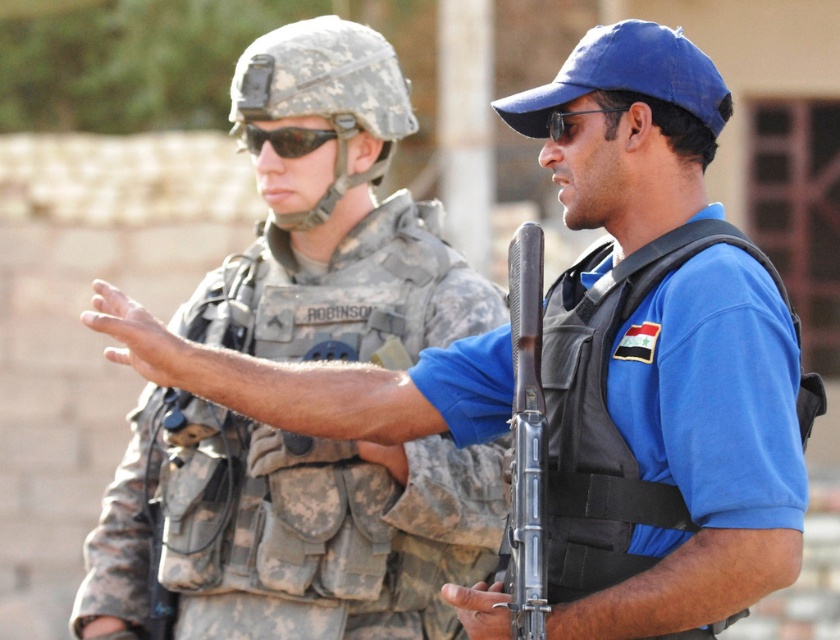
Does camouflage fabric uniform at center have a larger size compared to silver metallic rifle at center?

Incorrect, camouflage fabric uniform at center is not larger than silver metallic rifle at center.

Between camouflage fabric uniform at center and silver metallic rifle at center, which one is positioned lower?

camouflage fabric uniform at center is below.

Describe the element at coordinates (287, 529) in the screenshot. This screenshot has height=640, width=840. I see `camouflage fabric uniform at center` at that location.

Find the location of a particular element. Image resolution: width=840 pixels, height=640 pixels. camouflage fabric uniform at center is located at coordinates (287, 529).

Which of these two, silver metallic rifle at center or black matte sunglasses at center, stands taller?

With more height is silver metallic rifle at center.

Which is above, silver metallic rifle at center or black matte sunglasses at center?

Positioned higher is black matte sunglasses at center.

The height and width of the screenshot is (640, 840). What do you see at coordinates (526, 440) in the screenshot? I see `silver metallic rifle at center` at bounding box center [526, 440].

The height and width of the screenshot is (640, 840). In order to click on silver metallic rifle at center in this screenshot , I will do `click(526, 440)`.

Can you confirm if camouflage fabric uniform at center is shorter than black matte sunglasses at center?

Yes, camouflage fabric uniform at center is shorter than black matte sunglasses at center.

Can you confirm if camouflage fabric uniform at center is positioned to the right of black matte sunglasses at center?

Yes, camouflage fabric uniform at center is to the right of black matte sunglasses at center.

Who is more forward, (457, 307) or (303, 134)?

Point (457, 307) is in front.

At what (x,y) coordinates should I click in order to perform the action: click on camouflage fabric uniform at center. Please return your answer as a coordinate pair (x, y). The width and height of the screenshot is (840, 640). Looking at the image, I should click on (287, 529).